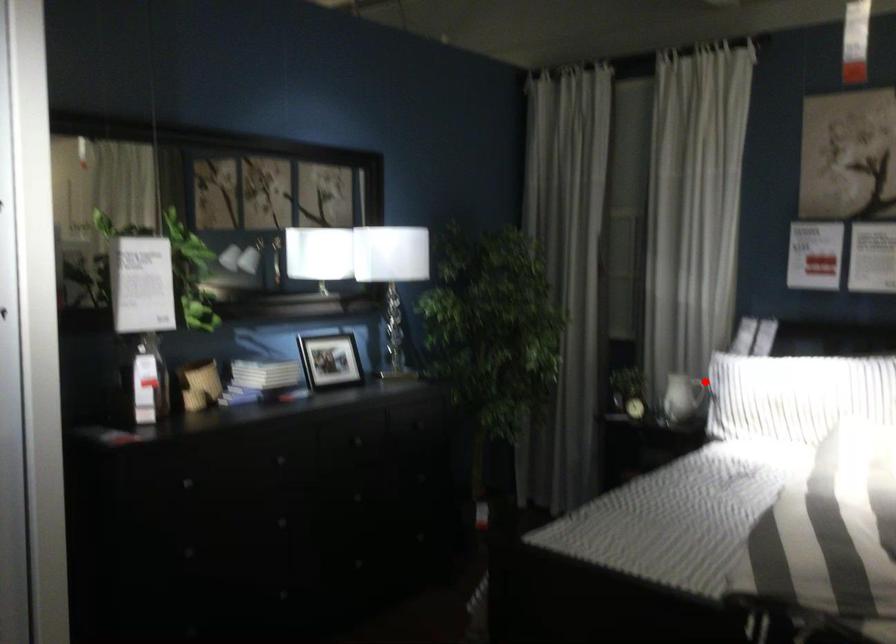
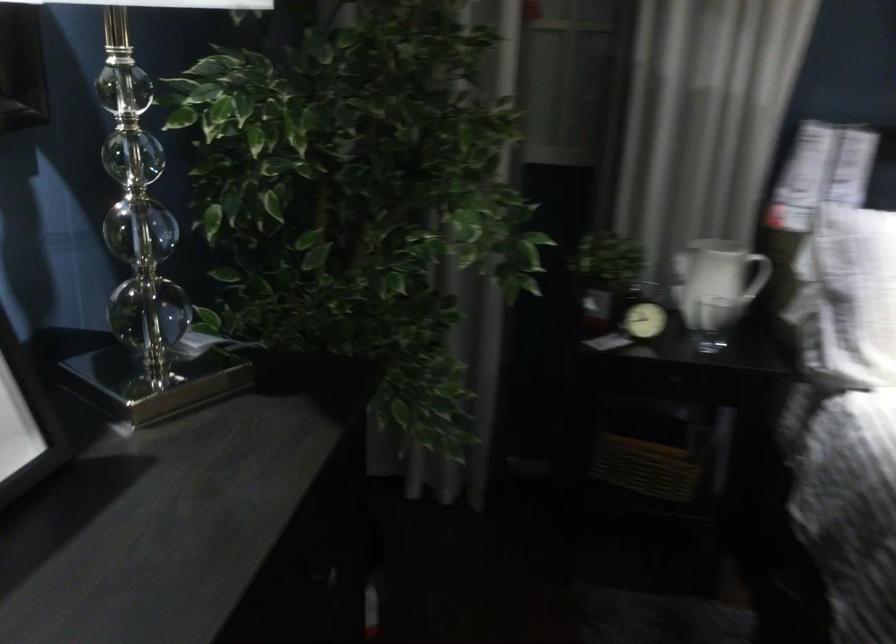
Question: I am providing you with two images of the same scene from different viewpoints. A red point is shown in image1. For the corresponding object point in image2, is it positioned nearer or farther from the camera?

Choices:
 (A) Nearer
 (B) Farther

Answer: (A)